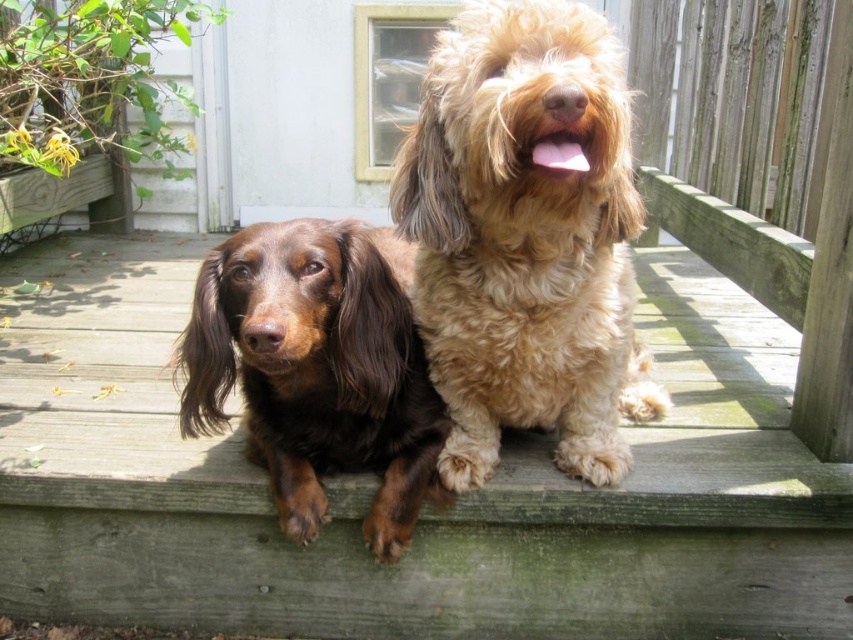
Question: Does wooden deck at center come in front of brown shaggy dog at left?

Choices:
 (A) no
 (B) yes

Answer: (A)

Question: Which object is farther from the camera taking this photo?

Choices:
 (A) wooden deck at center
 (B) brown shaggy dog at left

Answer: (A)

Question: Which object is closer to the camera taking this photo?

Choices:
 (A) brown shaggy dog at left
 (B) wooden deck at center
 (C) golden fluffy dog at center

Answer: (C)

Question: Can you confirm if wooden deck at center is positioned below golden fluffy dog at center?

Choices:
 (A) no
 (B) yes

Answer: (B)

Question: Which point appears closest to the camera in this image?

Choices:
 (A) (428, 566)
 (B) (209, 310)

Answer: (B)

Question: In this image, where is wooden deck at center located relative to brown shaggy dog at left?

Choices:
 (A) right
 (B) left

Answer: (A)